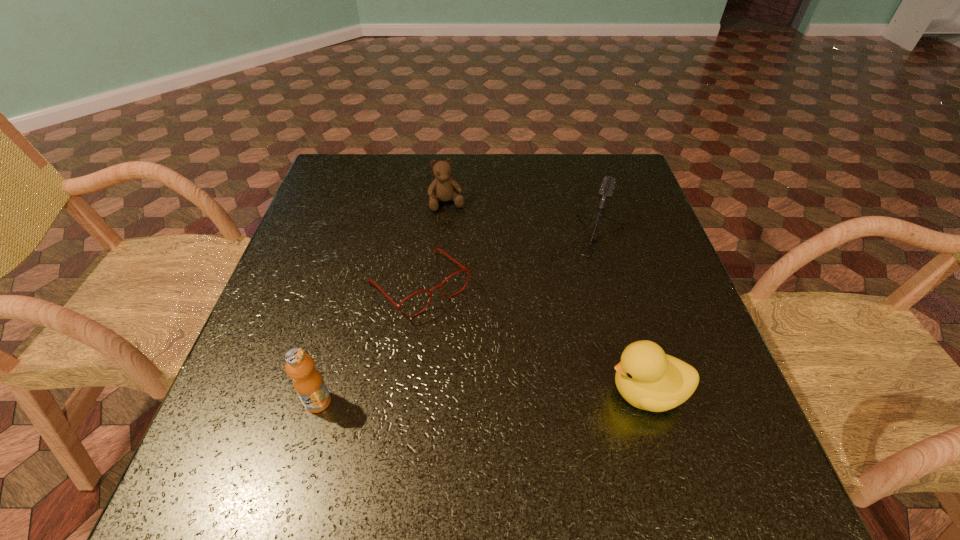
Where is `free space located 0.270m on the front-facing side of the farthest object`? free space located 0.270m on the front-facing side of the farthest object is located at coordinates (472, 286).

The width and height of the screenshot is (960, 540). What are the coordinates of `vacant space located on the face of the shortest object` in the screenshot? It's located at (549, 431).

Where is `free region located 0.210m on the face of the shortest object`? Image resolution: width=960 pixels, height=540 pixels. free region located 0.210m on the face of the shortest object is located at coordinates (512, 389).

You are a GUI agent. You are given a task and a screenshot of the screen. Output one action in this format:
    pyautogui.click(x=<x>, y=<y>)
    Task: Click on the vacant space located 0.070m on the face of the shortest object
    
    Given the screenshot: What is the action you would take?
    (468, 338)

This screenshot has height=540, width=960. I want to click on blank space located 0.080m on the stand of the microphone, so click(x=570, y=298).

What are the coordinates of `vacant region located on the stand of the microphone` in the screenshot? It's located at (534, 388).

What are the coordinates of `vacant region located on the stand of the microphone` in the screenshot? It's located at (571, 294).

Where is `object at the far edge`? This screenshot has height=540, width=960. object at the far edge is located at coordinates (441, 189).

This screenshot has height=540, width=960. Find the location of `orange juice that is at the near edge`. orange juice that is at the near edge is located at coordinates [x=308, y=383].

The width and height of the screenshot is (960, 540). Find the location of `duck present at the near edge`. duck present at the near edge is located at coordinates (647, 378).